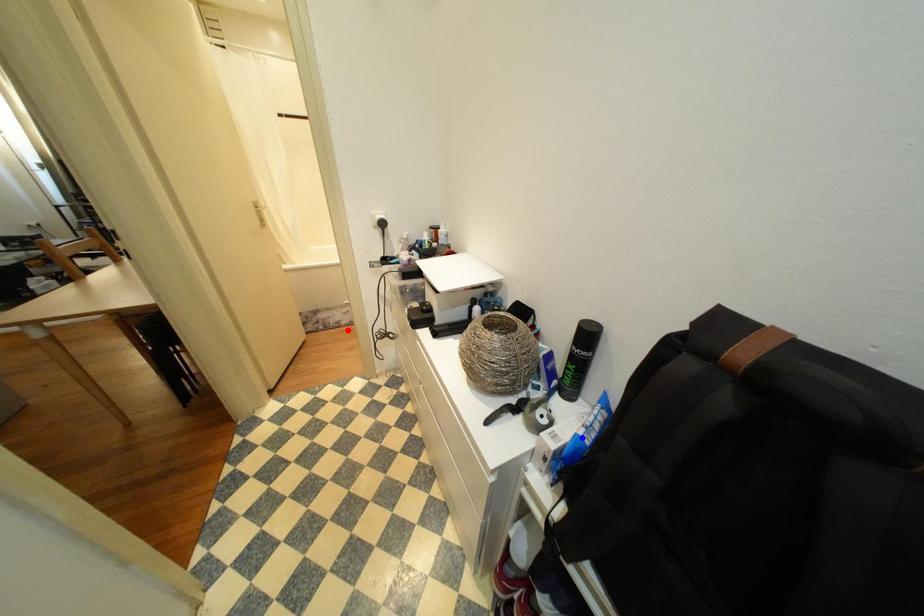
Question: Two points are marked on the image. Which point is closer to the camera?

Choices:
 (A) Blue point is closer.
 (B) Red point is closer.

Answer: (A)